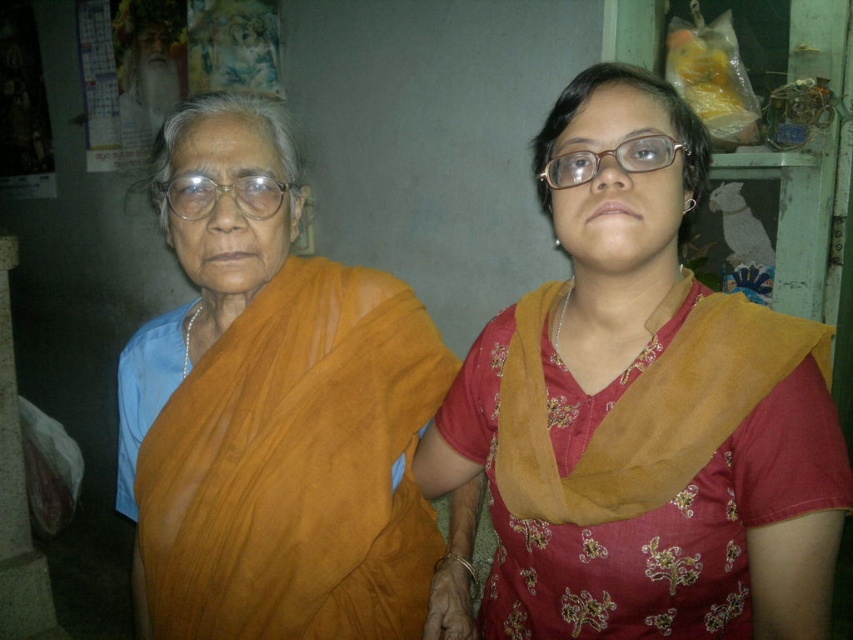
You are a photographer setting up a shoot in this room. You need to ensure that the orange fabric sari at left and the matte plastic glasses at center are both visible in the frame. Given their sizes, which object will require a wider angle to capture fully?

The orange fabric sari at left has a larger width than the matte plastic glasses at center, so it will require a wider angle to capture fully.

From the picture: You are a photographer setting up for a portrait session. You notice the matte orange scarf at center and the matte plastic glasses at left in the frame. Which object is positioned more to the left side of the image?

The matte plastic glasses at left is positioned more to the left side of the image.

You are organizing a fashion show and need to display the matte orange scarf at center and the orange fabric sari at left. Which item should be placed higher on the display rack to ensure they are visible to the audience?

The matte orange scarf at center should be placed higher on the display rack because it is shorter than the orange fabric sari at left, allowing both items to be seen clearly by the audience.